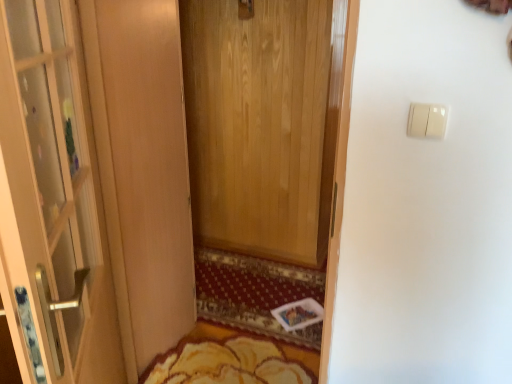
What is the approximate width of matte glass door at left?

The width of matte glass door at left is 6.43 inches.

This screenshot has height=384, width=512. I want to click on matte glass door at left, so click(x=52, y=203).

This screenshot has width=512, height=384. What are the coordinates of `yellow floral rug at lower center` in the screenshot? It's located at (232, 359).

The height and width of the screenshot is (384, 512). What do you see at coordinates (232, 359) in the screenshot?
I see `yellow floral rug at lower center` at bounding box center [232, 359].

Measure the distance between point (430, 115) and camera.

Point (430, 115) is 37.64 inches away from camera.

At what (x,y) coordinates should I click in order to perform the action: click on matte glass door at left. Please return your answer as a coordinate pair (x, y). This screenshot has height=384, width=512. Looking at the image, I should click on (52, 203).

Considering the relative sizes of yellow textured rug at center and yellow floral rug at lower center in the image provided, is yellow textured rug at center taller than yellow floral rug at lower center?

No.

Does yellow textured rug at center have a smaller size compared to yellow floral rug at lower center?

Actually, yellow textured rug at center might be larger than yellow floral rug at lower center.

Can you confirm if yellow textured rug at center is positioned to the left of yellow floral rug at lower center?

Incorrect, yellow textured rug at center is not on the left side of yellow floral rug at lower center.

From the image's perspective, which one is positioned lower, yellow textured rug at center or yellow floral rug at lower center?

yellow floral rug at lower center is shown below in the image.

Is matte glass door at left aimed at white plastic light switch at upper right?

No, matte glass door at left is not aimed at white plastic light switch at upper right.

Considering the relative sizes of matte glass door at left and white plastic light switch at upper right in the image provided, is matte glass door at left smaller than white plastic light switch at upper right?

Incorrect, matte glass door at left is not smaller in size than white plastic light switch at upper right.

Between matte glass door at left and white plastic light switch at upper right, which one has smaller width?

Thinner between the two is white plastic light switch at upper right.

Looking at this image, measure the distance from matte glass door at left to white plastic light switch at upper right.

matte glass door at left is 35.07 inches away from white plastic light switch at upper right.

In order to click on light switch lying on the right of yellow floral rug at lower center in this screenshot , I will do `click(426, 120)`.

From the picture: Are white plastic light switch at upper right and yellow floral rug at lower center beside each other?

No, white plastic light switch at upper right is not making contact with yellow floral rug at lower center.

Between white plastic light switch at upper right and yellow floral rug at lower center, which one has larger size?

yellow floral rug at lower center is bigger.

Does white plastic light switch at upper right have a greater height compared to yellow floral rug at lower center?

Indeed, white plastic light switch at upper right has a greater height compared to yellow floral rug at lower center.

From a real-world perspective, which is physically below, matte glass door at left or yellow floral rug at lower center?

yellow floral rug at lower center.

From the image's perspective, which is above, matte glass door at left or yellow floral rug at lower center?

matte glass door at left.

In order to click on door in front of the yellow floral rug at lower center in this screenshot , I will do `click(52, 203)`.

Does matte glass door at left lie behind yellow floral rug at lower center?

No, matte glass door at left is closer to the camera.

Is yellow textured rug at center aimed at matte glass door at left?

No, yellow textured rug at center is not oriented towards matte glass door at left.

Who is taller, yellow textured rug at center or matte glass door at left?

With more height is matte glass door at left.

Is yellow textured rug at center bigger or smaller than matte glass door at left?

yellow textured rug at center is smaller than matte glass door at left.

Considering the relative sizes of yellow textured rug at center and matte glass door at left in the image provided, is yellow textured rug at center thinner than matte glass door at left?

No.

Is white plastic light switch at upper right outside of yellow textured rug at center?

Yes, white plastic light switch at upper right is located beyond the bounds of yellow textured rug at center.

Considering the sizes of objects white plastic light switch at upper right and yellow textured rug at center in the image provided, who is smaller, white plastic light switch at upper right or yellow textured rug at center?

With smaller size is white plastic light switch at upper right.

From the image's perspective, which is above, white plastic light switch at upper right or yellow textured rug at center?

white plastic light switch at upper right, from the image's perspective.

Is white plastic light switch at upper right not near yellow textured rug at center?

That's right, there is a large distance between white plastic light switch at upper right and yellow textured rug at center.

I want to click on doormat that appears above the yellow floral rug at lower center (from the image's perspective), so click(x=255, y=293).

Between yellow floral rug at lower center and yellow textured rug at center, which one has less height?

yellow textured rug at center.

How many degrees apart are the facing directions of yellow floral rug at lower center and yellow textured rug at center?

The angular difference between yellow floral rug at lower center and yellow textured rug at center is 1.7 degrees.

From the image's perspective, which one is positioned lower, yellow floral rug at lower center or yellow textured rug at center?

yellow floral rug at lower center.

Find the location of `mat above the yellow textured rug at center (from a real-world perspective)`. mat above the yellow textured rug at center (from a real-world perspective) is located at coordinates (232, 359).

Identify the location of door that appears on the left of white plastic light switch at upper right. pos(52,203).

Looking at the image, which one is located closer to yellow floral rug at lower center, matte glass door at left or white plastic light switch at upper right?

matte glass door at left is positioned closer to the anchor yellow floral rug at lower center.

When comparing their distances from yellow floral rug at lower center, does white plastic light switch at upper right or yellow textured rug at center seem further?

Based on the image, white plastic light switch at upper right appears to be further to yellow floral rug at lower center.

From the image, which object appears to be nearer to matte glass door at left, white plastic light switch at upper right or yellow textured rug at center?

Among the two, white plastic light switch at upper right is located nearer to matte glass door at left.

Estimate the real-world distances between objects in this image. Which object is further from yellow textured rug at center, matte glass door at left or yellow floral rug at lower center?

The object further to yellow textured rug at center is matte glass door at left.

From the image, which object appears to be farther from yellow floral rug at lower center, matte glass door at left or yellow textured rug at center?

matte glass door at left.

Considering their positions, is yellow textured rug at center positioned further to matte glass door at left than yellow floral rug at lower center?

yellow textured rug at center lies further to matte glass door at left than the other object.

From the image, which object appears to be farther from yellow floral rug at lower center, white plastic light switch at upper right or matte glass door at left?

white plastic light switch at upper right is further to yellow floral rug at lower center.

Estimate the real-world distances between objects in this image. Which object is closer to white plastic light switch at upper right, yellow textured rug at center or matte glass door at left?

matte glass door at left.

This screenshot has height=384, width=512. What are the coordinates of `mat between matte glass door at left and yellow textured rug at center from front to back` in the screenshot? It's located at (232, 359).

Locate an element on the screen. light switch located between matte glass door at left and yellow floral rug at lower center in the depth direction is located at coordinates (426, 120).

Find the location of a particular element. Image resolution: width=512 pixels, height=384 pixels. mat between white plastic light switch at upper right and yellow textured rug at center from front to back is located at coordinates (232, 359).

Image resolution: width=512 pixels, height=384 pixels. Find the location of `light switch between matte glass door at left and yellow textured rug at center from front to back`. light switch between matte glass door at left and yellow textured rug at center from front to back is located at coordinates (426, 120).